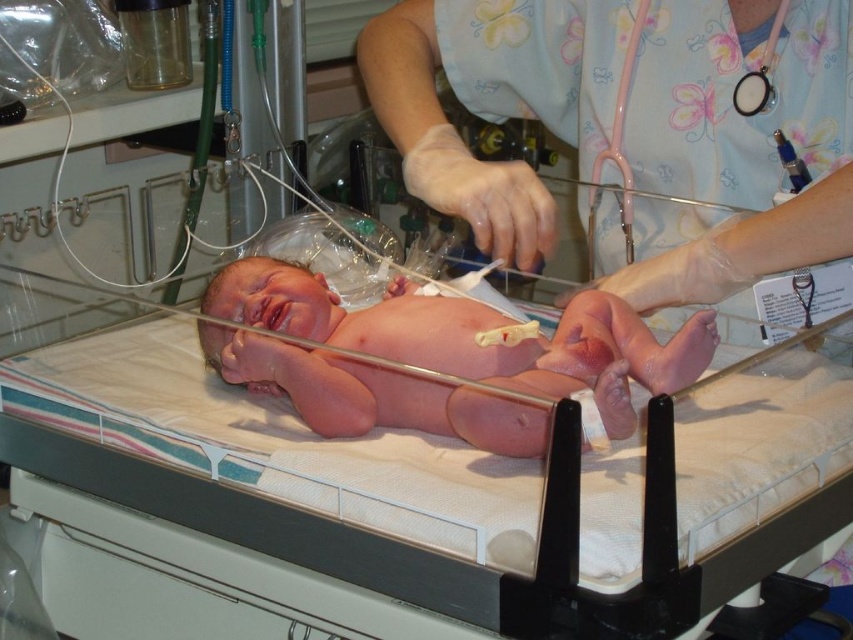
Does pink floral scrubs at center have a lesser width compared to pink smooth skin at center?

Yes.

What do you see at coordinates (730, 148) in the screenshot? I see `pink floral scrubs at center` at bounding box center [730, 148].

This screenshot has height=640, width=853. Identify the location of pink floral scrubs at center. (730, 148).

Does pink floral scrubs at center have a larger size compared to pink rubber stethoscope at upper right?

Correct, pink floral scrubs at center is larger in size than pink rubber stethoscope at upper right.

From the picture: Who is shorter, pink floral scrubs at center or pink rubber stethoscope at upper right?

With less height is pink rubber stethoscope at upper right.

Is point (540, 236) positioned after point (595, 236)?

That is False.

Image resolution: width=853 pixels, height=640 pixels. Identify the location of pink floral scrubs at center. (730, 148).

Is pink smooth skin at center behind pink rubber stethoscope at upper right?

No.

Is point (485, 440) positioned in front of point (619, 147)?

Yes, it is.

Is point (480, 310) behind point (590, 221)?

No, (480, 310) is closer to viewer.

Identify the location of pink smooth skin at center. The width and height of the screenshot is (853, 640). (473, 336).